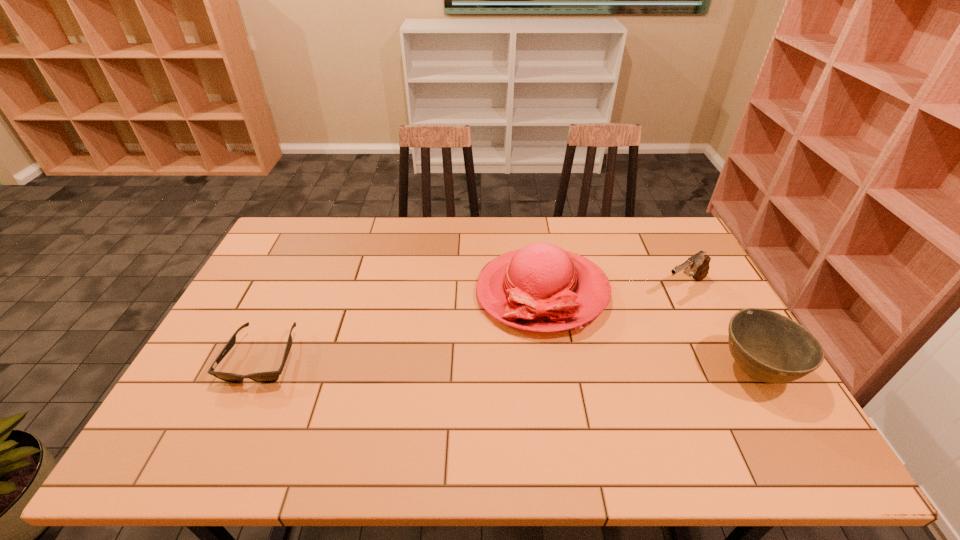
Image resolution: width=960 pixels, height=540 pixels. I want to click on blank space that satisfies the following two spatial constraints: 1. on the front-facing side of the bowl; 2. on the right side of the leftmost object, so click(x=256, y=372).

At what (x,y) coordinates should I click in order to perform the action: click on free space that satisfies the following two spatial constraints: 1. on the front-facing side of the bowl; 2. on the right side of the sunglasses. Please return your answer as a coordinate pair (x, y). Looking at the image, I should click on (256, 372).

The width and height of the screenshot is (960, 540). I want to click on vacant point that satisfies the following two spatial constraints: 1. on the front-facing side of the bowl; 2. on the left side of the shortest object, so click(256, 372).